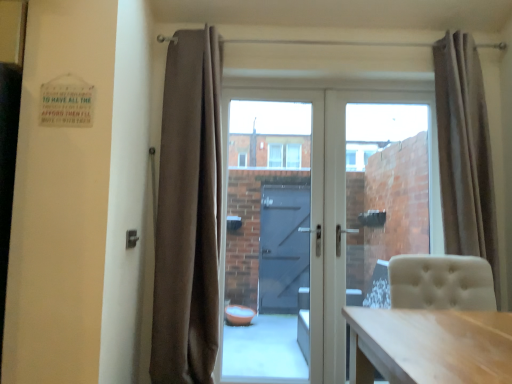
Question: From the image's perspective, is transparent glass door at center, marked as the first glass door in a left-to-right arrangement, located above or below white glass door at center?

Choices:
 (A) below
 (B) above

Answer: (B)

Question: Is point [x=227, y=129] closer or farther from the camera than point [x=368, y=230]?

Choices:
 (A) farther
 (B) closer

Answer: (B)

Question: Considering the real-world distances, which object is closest to the white glass door at center?

Choices:
 (A) transparent glass door at center, the 1th glass door in the right-to-left sequence
 (B) transparent glass door at center, the second glass door when ordered from right to left
 (C) beige fabric curtain at right, arranged as the 2th curtain when viewed from the left
 (D) brown velvet curtain at center, which ranks as the second curtain in right-to-left order

Answer: (A)

Question: Considering the real-world distances, which object is closest to the transparent glass door at center, the second glass door when ordered from right to left?

Choices:
 (A) beige fabric curtain at right, which is the first curtain from right to left
 (B) white glass door at center
 (C) brown velvet curtain at center, which ranks as the second curtain in right-to-left order
 (D) transparent glass door at center, the 1th glass door in the right-to-left sequence

Answer: (B)